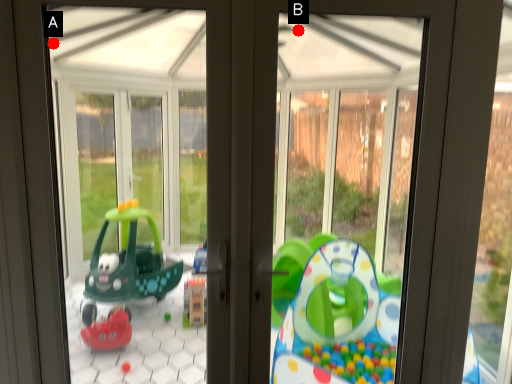
Question: Two points are circled on the image, labeled by A and B beside each circle. Which point appears closest to the camera in this image?

Choices:
 (A) A is closer
 (B) B is closer

Answer: (A)